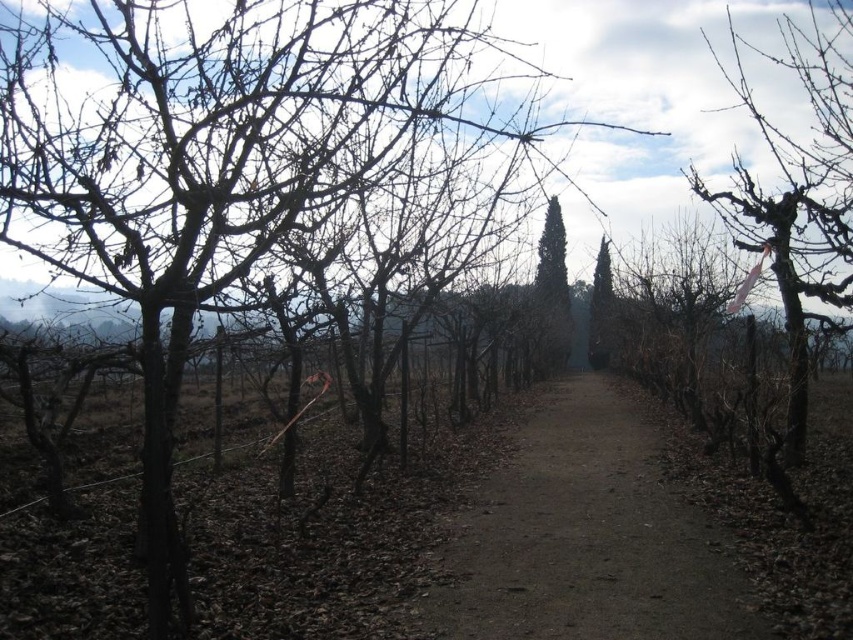
You are standing at the point labeled point (799, 193) in the image. To your right, there is a pink ribbon. What is the nearest object to your right side?

The nearest object to your right side is the pink ribbon at right.